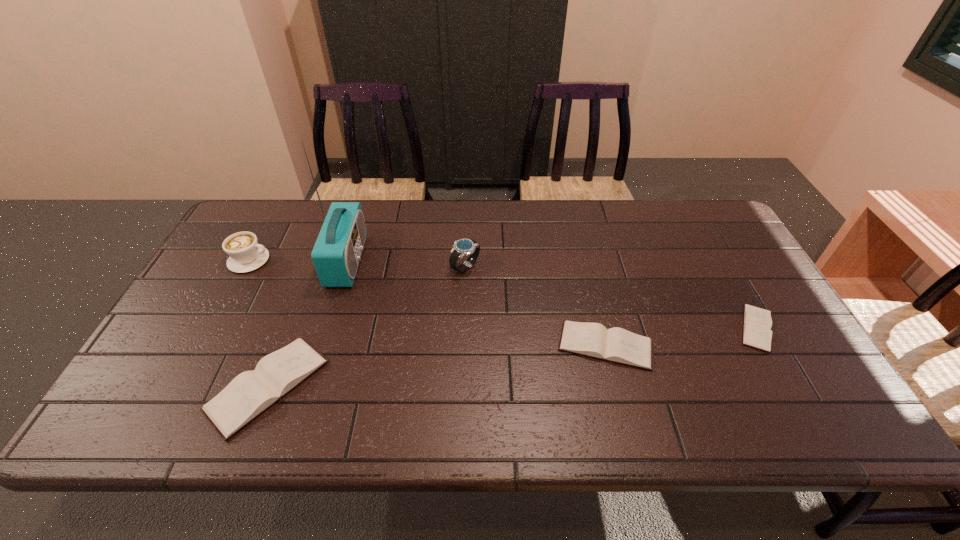
Locate an element on the screen. vacant region that satisfies the following two spatial constraints: 1. to the right of the third object from right to left's handle; 2. on the right side of the cappuccino is located at coordinates (246, 267).

At what (x,y) coordinates should I click in order to perform the action: click on vacant space that satisfies the following two spatial constraints: 1. on the front panel of the radio receiver; 2. on the right side of the watch. Please return your answer as a coordinate pair (x, y). This screenshot has width=960, height=540. Looking at the image, I should click on (345, 267).

Locate an element on the screen. This screenshot has width=960, height=540. free point that satisfies the following two spatial constraints: 1. to the right of the third object from right to left's handle; 2. on the left side of the cappuccino is located at coordinates (246, 267).

Where is `vacant space that satisfies the following two spatial constraints: 1. on the back side of the watch; 2. to the right of the leftmost object's handle`? This screenshot has width=960, height=540. vacant space that satisfies the following two spatial constraints: 1. on the back side of the watch; 2. to the right of the leftmost object's handle is located at coordinates (466, 260).

You are a GUI agent. You are given a task and a screenshot of the screen. Output one action in this format:
    pyautogui.click(x=<x>, y=<y>)
    Task: Click on the free location that satisfies the following two spatial constraints: 1. on the back side of the fifth object from left to right; 2. to the right of the leftmost object's handle
    This screenshot has width=960, height=540.
    Given the screenshot: What is the action you would take?
    pyautogui.click(x=585, y=260)

The image size is (960, 540). What are the coordinates of `free location that satisfies the following two spatial constraints: 1. on the front panel of the tallest object; 2. on the back side of the second object from right to left` in the screenshot? It's located at (321, 346).